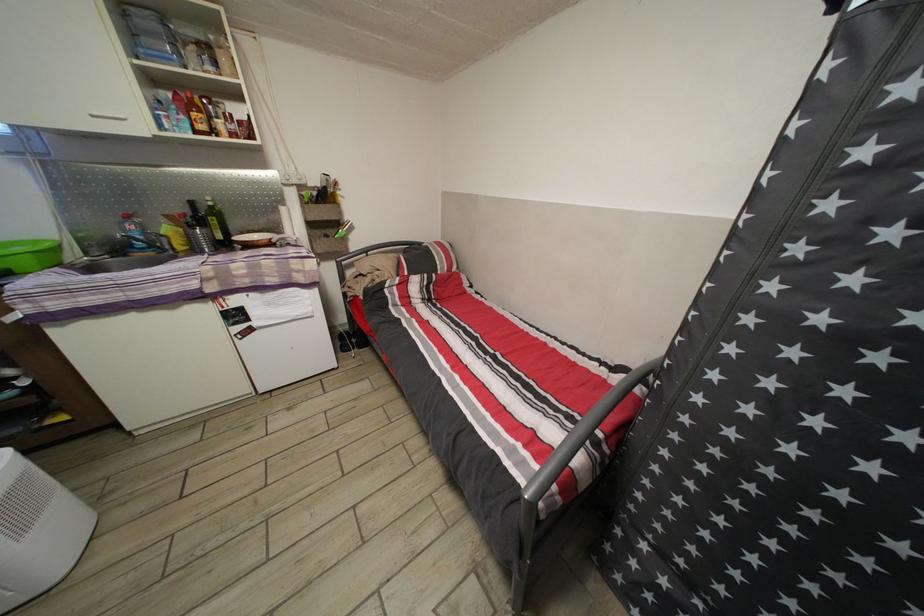
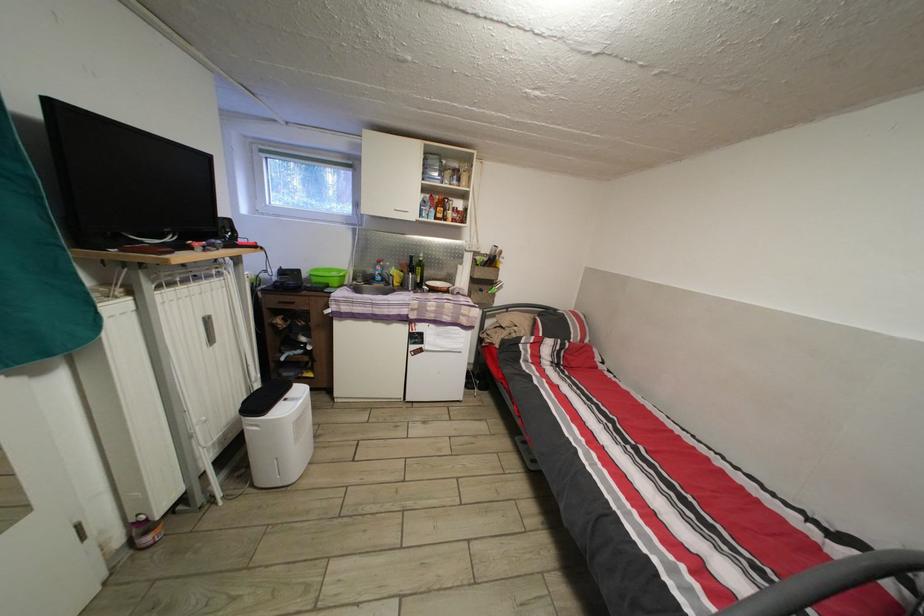
Question: The images are taken continuously from a first-person perspective. In which direction is your viewpoint rotating?

Choices:
 (A) Left
 (B) Right
 (C) Up
 (D) Down

Answer: (A)